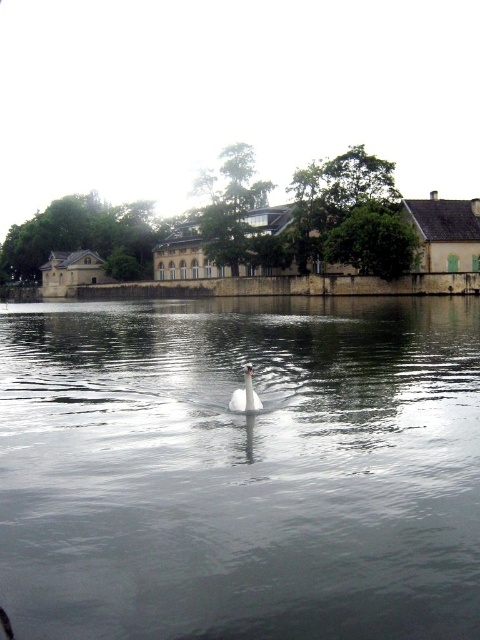
Can you confirm if clear water at center is thinner than white glossy swan at center?

Incorrect, clear water at center's width is not less than white glossy swan at center's.

Between point (466, 349) and point (259, 410), which one is positioned behind?

Point (466, 349)

Locate an element on the screen. Image resolution: width=480 pixels, height=640 pixels. clear water at center is located at coordinates (240, 468).